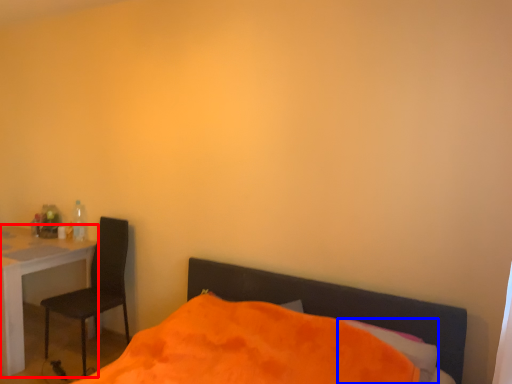
Question: Which of the following is the farthest to the observer, desk (highlighted by a red box) or pillow (highlighted by a blue box)?

Choices:
 (A) desk
 (B) pillow

Answer: (A)